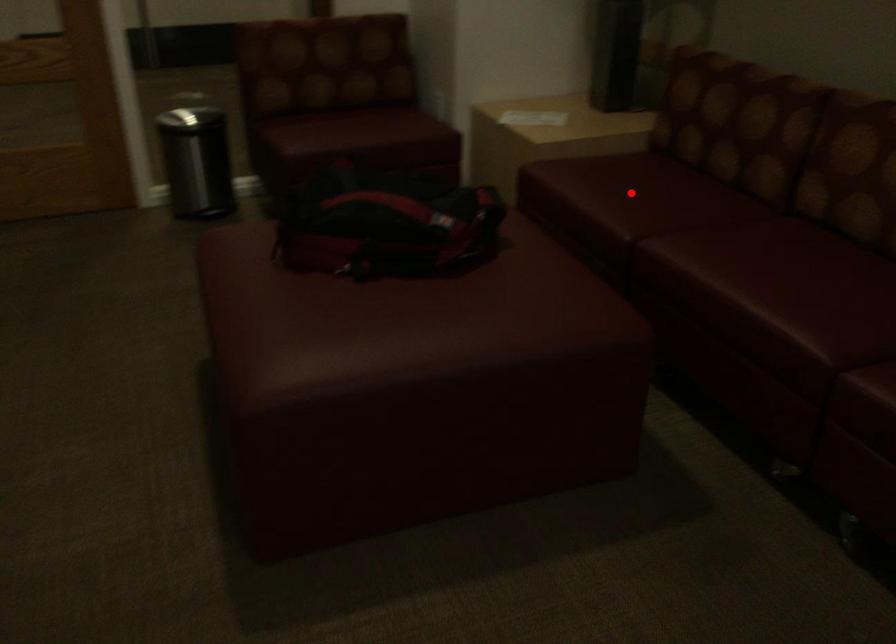
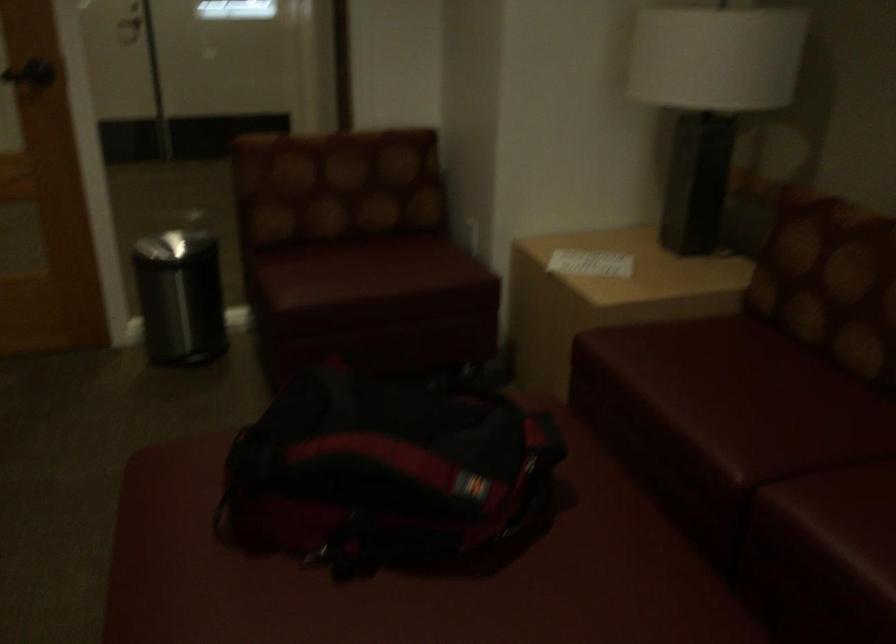
Question: I am providing you with two images of the same scene from different viewpoints. In image1, a red point is highlighted. Considering the same 3D point in image2, which of the following is correct?

Choices:
 (A) It is closer
 (B) It is farther

Answer: (A)